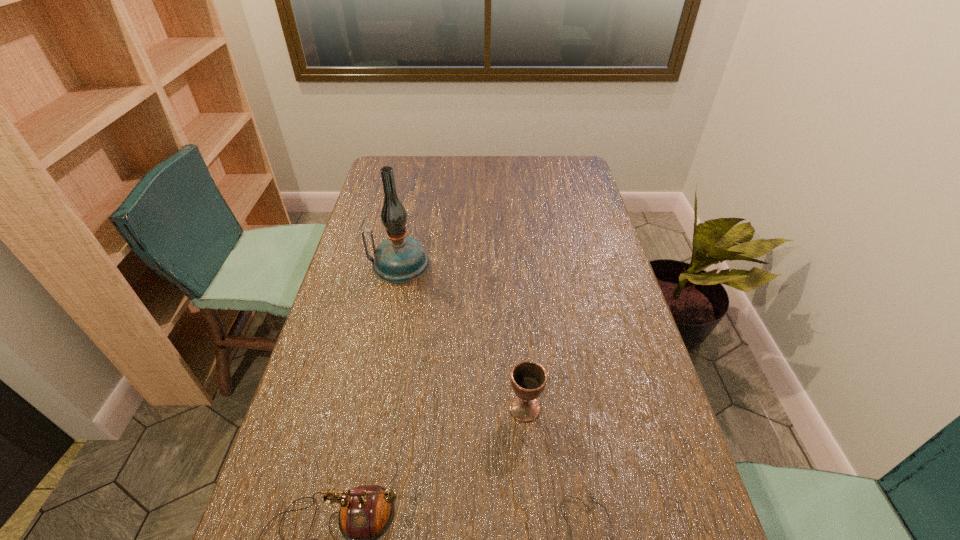
Identify the location of oil lamp. Image resolution: width=960 pixels, height=540 pixels. (399, 259).

Where is `the farthest object`? The image size is (960, 540). the farthest object is located at coordinates (399, 259).

The image size is (960, 540). I want to click on the third nearest object, so click(528, 378).

Locate an element on the screen. The height and width of the screenshot is (540, 960). the third object from left to right is located at coordinates (528, 378).

I want to click on vacant space situated on the front of the farthest object, so click(x=386, y=330).

What are the coordinates of `free spot located 0.360m on the back of the second farthest object` in the screenshot? It's located at (516, 291).

This screenshot has height=540, width=960. I want to click on object that is at the left edge, so click(x=399, y=259).

Locate an element on the screen. The height and width of the screenshot is (540, 960). blank space at the far edge is located at coordinates pyautogui.click(x=524, y=157).

Where is `free space at the left edge of the desktop`? This screenshot has height=540, width=960. free space at the left edge of the desktop is located at coordinates (342, 365).

Identify the location of vacant space at the right edge of the desktop. (577, 232).